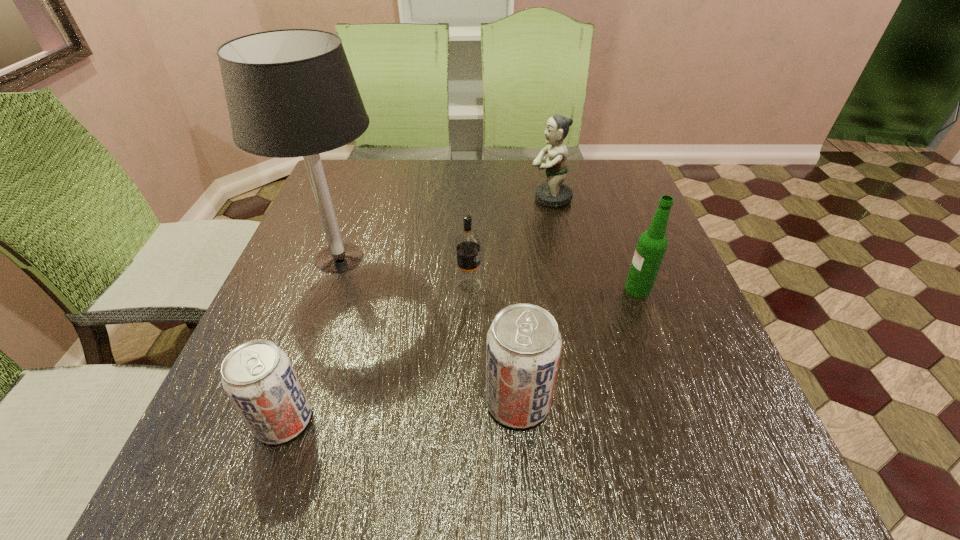
Locate an element on the screen. The image size is (960, 540). object that ranks as the closest to the farthest object is located at coordinates (652, 244).

Find the location of a particular element. This screenshot has width=960, height=540. vacant space that satisfies the following two spatial constraints: 1. on the label of the third object from right to left; 2. on the right side of the fourth object from right to left is located at coordinates (466, 402).

Identify the location of free space that satisfies the following two spatial constraints: 1. on the front-facing side of the figurine; 2. on the front side of the left soda can. (597, 421).